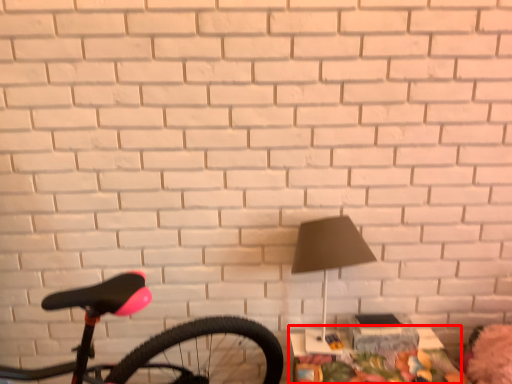
Question: Considering the relative positions of table (annotated by the red box) and lamp in the image provided, where is table (annotated by the red box) located with respect to the staircase?

Choices:
 (A) right
 (B) left

Answer: (A)